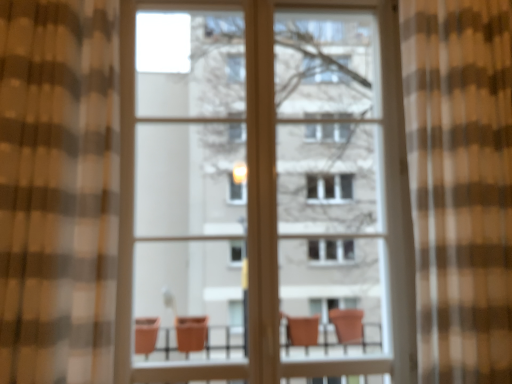
What do you see at coordinates (460, 184) in the screenshot? I see `brown sheer curtain at right, marked as the first curtain in a right-to-left arrangement` at bounding box center [460, 184].

Where is `matte glass screen door at center`? This screenshot has width=512, height=384. matte glass screen door at center is located at coordinates click(189, 183).

This screenshot has height=384, width=512. What do you see at coordinates (58, 190) in the screenshot?
I see `brown checkered curtain at left, which is the 1th curtain from left to right` at bounding box center [58, 190].

The image size is (512, 384). What are the coordinates of `brown sheer curtain at right, placed as the second curtain when sorted from left to right` in the screenshot? It's located at (460, 184).

Considering the points (464, 351) and (51, 300), which point is in front, point (464, 351) or point (51, 300)?

The point (51, 300) is in front.

From the image's perspective, which one is positioned lower, brown sheer curtain at right, marked as the first curtain in a right-to-left arrangement, or brown checkered curtain at left, which ranks as the second curtain in right-to-left order?

brown checkered curtain at left, which ranks as the second curtain in right-to-left order, appears lower in the image.

The height and width of the screenshot is (384, 512). I want to click on curtain below the brown sheer curtain at right, placed as the second curtain when sorted from left to right (from the image's perspective), so click(x=58, y=190).

Is point (224, 330) more distant than point (54, 361)?

Yes, it is behind point (54, 361).

Are matte glass screen door at center and brown checkered curtain at left, which ranks as the second curtain in right-to-left order, far apart?

No, matte glass screen door at center is not far from brown checkered curtain at left, which ranks as the second curtain in right-to-left order.

Considering the relative sizes of matte glass screen door at center and brown checkered curtain at left, which is the 1th curtain from left to right, in the image provided, is matte glass screen door at center shorter than brown checkered curtain at left, which is the 1th curtain from left to right,?

In fact, matte glass screen door at center may be taller than brown checkered curtain at left, which is the 1th curtain from left to right.

Is matte glass screen door at center facing away from brown checkered curtain at left, which ranks as the second curtain in right-to-left order?

No, matte glass screen door at center's orientation is not away from brown checkered curtain at left, which ranks as the second curtain in right-to-left order.

From a real-world perspective, is brown checkered curtain at left, which is the 1th curtain from left to right, physically below brown sheer curtain at right, marked as the first curtain in a right-to-left arrangement?

Incorrect, from a real-world perspective, brown checkered curtain at left, which is the 1th curtain from left to right, is higher than brown sheer curtain at right, marked as the first curtain in a right-to-left arrangement.

Which is correct: brown checkered curtain at left, which ranks as the second curtain in right-to-left order, is inside brown sheer curtain at right, placed as the second curtain when sorted from left to right, or outside of it?

brown checkered curtain at left, which ranks as the second curtain in right-to-left order, is outside brown sheer curtain at right, placed as the second curtain when sorted from left to right.

Is brown sheer curtain at right, placed as the second curtain when sorted from left to right, at the back of brown checkered curtain at left, which is the 1th curtain from left to right?

That's not correct — brown checkered curtain at left, which is the 1th curtain from left to right, is not looking away from brown sheer curtain at right, placed as the second curtain when sorted from left to right.

Is point (36, 277) positioned in front of point (490, 35)?

That is True.

Is brown checkered curtain at left, which ranks as the second curtain in right-to-left order, outside of matte glass screen door at center?

Yes, brown checkered curtain at left, which ranks as the second curtain in right-to-left order, is not within matte glass screen door at center.

What are the coordinates of `curtain that is on the left side of matte glass screen door at center` in the screenshot? It's located at (58, 190).

Is brown checkered curtain at left, which is the 1th curtain from left to right, far from matte glass screen door at center?

No, brown checkered curtain at left, which is the 1th curtain from left to right, is in close proximity to matte glass screen door at center.

What's the angular difference between brown checkered curtain at left, which ranks as the second curtain in right-to-left order, and matte glass screen door at center's facing directions?

The angle between the facing direction of brown checkered curtain at left, which ranks as the second curtain in right-to-left order, and the facing direction of matte glass screen door at center is 0.202 degrees.

Considering the positions of objects matte glass screen door at center and brown sheer curtain at right, placed as the second curtain when sorted from left to right, in the image provided, who is more to the right, matte glass screen door at center or brown sheer curtain at right, placed as the second curtain when sorted from left to right,?

Positioned to the right is brown sheer curtain at right, placed as the second curtain when sorted from left to right.

Consider the image. From a real-world perspective, is matte glass screen door at center positioned over brown sheer curtain at right, marked as the first curtain in a right-to-left arrangement, based on gravity?

Yes.

Is there a large distance between matte glass screen door at center and brown sheer curtain at right, marked as the first curtain in a right-to-left arrangement?

Yes, matte glass screen door at center and brown sheer curtain at right, marked as the first curtain in a right-to-left arrangement, are located far from each other.

Based on the photo, how much distance is there between matte glass screen door at center and brown sheer curtain at right, marked as the first curtain in a right-to-left arrangement?

matte glass screen door at center and brown sheer curtain at right, marked as the first curtain in a right-to-left arrangement, are 3.85 feet apart from each other.

In the scene shown: Considering the sizes of objects brown sheer curtain at right, marked as the first curtain in a right-to-left arrangement, and matte glass screen door at center in the image provided, who is bigger, brown sheer curtain at right, marked as the first curtain in a right-to-left arrangement, or matte glass screen door at center?

Bigger between the two is brown sheer curtain at right, marked as the first curtain in a right-to-left arrangement.

This screenshot has height=384, width=512. In order to click on screen door lying on the left of brown sheer curtain at right, placed as the second curtain when sorted from left to right in this screenshot , I will do `click(189, 183)`.

Which of these two, brown sheer curtain at right, placed as the second curtain when sorted from left to right, or matte glass screen door at center, stands shorter?

brown sheer curtain at right, placed as the second curtain when sorted from left to right.

Is brown sheer curtain at right, marked as the first curtain in a right-to-left arrangement, surrounding matte glass screen door at center?

No, brown sheer curtain at right, marked as the first curtain in a right-to-left arrangement, does not contain matte glass screen door at center.

Find the location of a particular element. Image resolution: width=512 pixels, height=384 pixels. curtain in front of the brown sheer curtain at right, marked as the first curtain in a right-to-left arrangement is located at coordinates (58, 190).

Where is `screen door on the right of the brown checkered curtain at left, which is the 1th curtain from left to right`? Image resolution: width=512 pixels, height=384 pixels. screen door on the right of the brown checkered curtain at left, which is the 1th curtain from left to right is located at coordinates (189, 183).

When comparing their distances from brown sheer curtain at right, placed as the second curtain when sorted from left to right, does brown checkered curtain at left, which ranks as the second curtain in right-to-left order, or matte glass screen door at center seem further?

Based on the image, matte glass screen door at center appears to be further to brown sheer curtain at right, placed as the second curtain when sorted from left to right.

Which object lies further to the anchor point brown sheer curtain at right, placed as the second curtain when sorted from left to right, matte glass screen door at center or brown checkered curtain at left, which is the 1th curtain from left to right?

Among the two, matte glass screen door at center is located further to brown sheer curtain at right, placed as the second curtain when sorted from left to right.

From the image, which object appears to be farther from brown checkered curtain at left, which ranks as the second curtain in right-to-left order, matte glass screen door at center or brown sheer curtain at right, placed as the second curtain when sorted from left to right?

Among the two, brown sheer curtain at right, placed as the second curtain when sorted from left to right, is located further to brown checkered curtain at left, which ranks as the second curtain in right-to-left order.

Looking at the image, which one is located further to matte glass screen door at center, brown sheer curtain at right, marked as the first curtain in a right-to-left arrangement, or brown checkered curtain at left, which ranks as the second curtain in right-to-left order?

brown sheer curtain at right, marked as the first curtain in a right-to-left arrangement, is positioned further to the anchor matte glass screen door at center.

From the image, which object appears to be farther from matte glass screen door at center, brown checkered curtain at left, which is the 1th curtain from left to right, or brown sheer curtain at right, placed as the second curtain when sorted from left to right?

Based on the image, brown sheer curtain at right, placed as the second curtain when sorted from left to right, appears to be further to matte glass screen door at center.

Which object lies further to the anchor point brown checkered curtain at left, which is the 1th curtain from left to right, brown sheer curtain at right, marked as the first curtain in a right-to-left arrangement, or matte glass screen door at center?

Among the two, brown sheer curtain at right, marked as the first curtain in a right-to-left arrangement, is located further to brown checkered curtain at left, which is the 1th curtain from left to right.

The height and width of the screenshot is (384, 512). What are the coordinates of `screen door between brown checkered curtain at left, which ranks as the second curtain in right-to-left order, and brown sheer curtain at right, placed as the second curtain when sorted from left to right` in the screenshot? It's located at (189, 183).